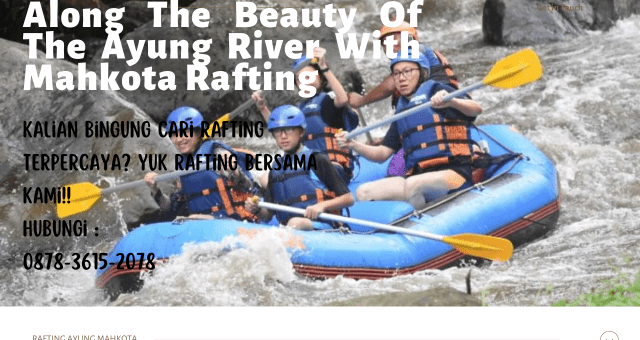
Find the location of a particular element. handle is located at coordinates (361, 221).